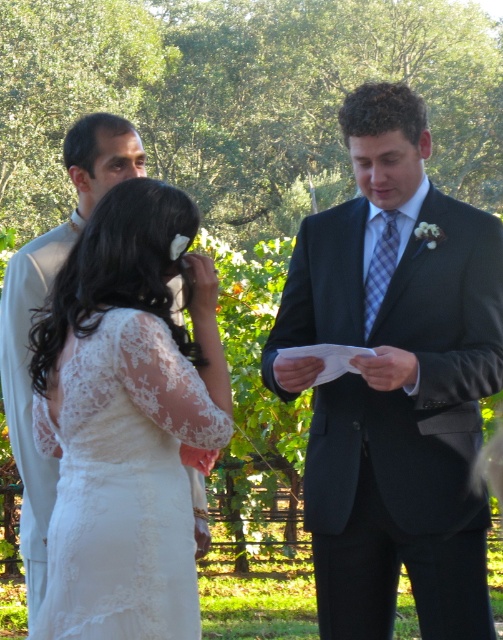
Question: Can you confirm if matte black suit at center is thinner than white lace dress at center?

Choices:
 (A) no
 (B) yes

Answer: (A)

Question: Among these points, which one is farthest from the camera?

Choices:
 (A) pyautogui.click(x=437, y=461)
 (B) pyautogui.click(x=61, y=339)

Answer: (A)

Question: Does matte black suit at center come in front of white lace dress at center?

Choices:
 (A) yes
 (B) no

Answer: (B)

Question: From the image, what is the correct spatial relationship of matte black suit at center in relation to white lace dress at center?

Choices:
 (A) left
 (B) right

Answer: (B)

Question: Which object appears closest to the camera in this image?

Choices:
 (A) white lace dress at center
 (B) matte black suit at center

Answer: (A)